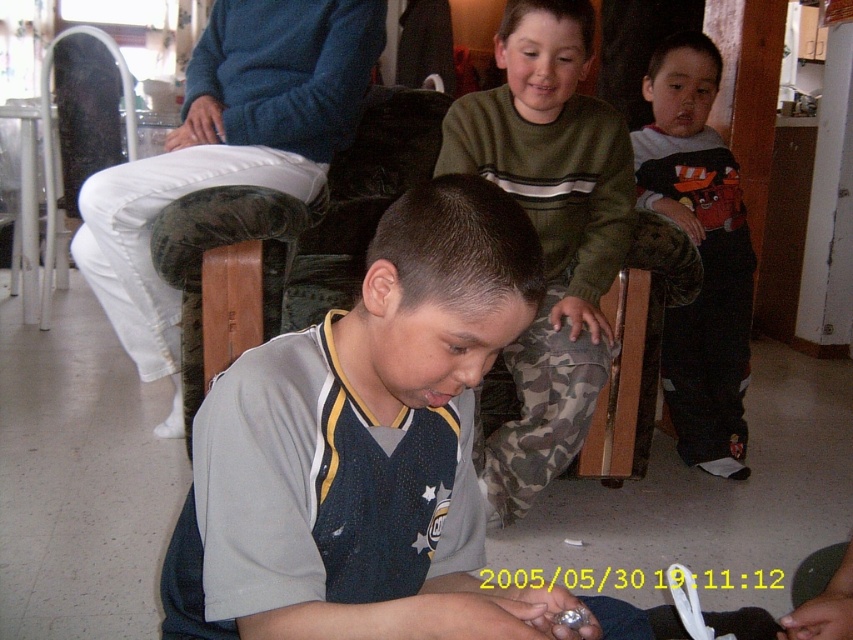
Question: Which object is positioned closest to the green sweater at upper center?

Choices:
 (A) gray mesh shirt at center
 (B) dark gray sweater at upper right

Answer: (B)

Question: Can you confirm if blue fleece sweater at upper center is positioned above dark gray sweater at upper right?

Choices:
 (A) no
 (B) yes

Answer: (B)

Question: Which of the following is the farthest from the observer?

Choices:
 (A) dark gray sweater at upper right
 (B) green sweater at upper center
 (C) gray mesh shirt at center

Answer: (A)

Question: Observing the image, what is the correct spatial positioning of gray mesh shirt at center in reference to dark gray sweater at upper right?

Choices:
 (A) left
 (B) right

Answer: (A)

Question: Does green sweater at upper center have a smaller size compared to blue fleece sweater at upper center?

Choices:
 (A) no
 (B) yes

Answer: (B)

Question: Considering the real-world distances, which object is closest to the gray mesh shirt at center?

Choices:
 (A) blue fleece sweater at upper center
 (B) dark gray sweater at upper right

Answer: (A)